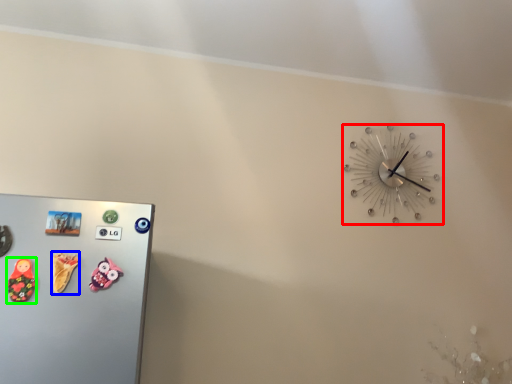
Question: Based on their relative distances, which object is nearer to wall clock (highlighted by a red box)? Choose from toy (highlighted by a blue box) and toy (highlighted by a green box).

Choices:
 (A) toy
 (B) toy

Answer: (A)